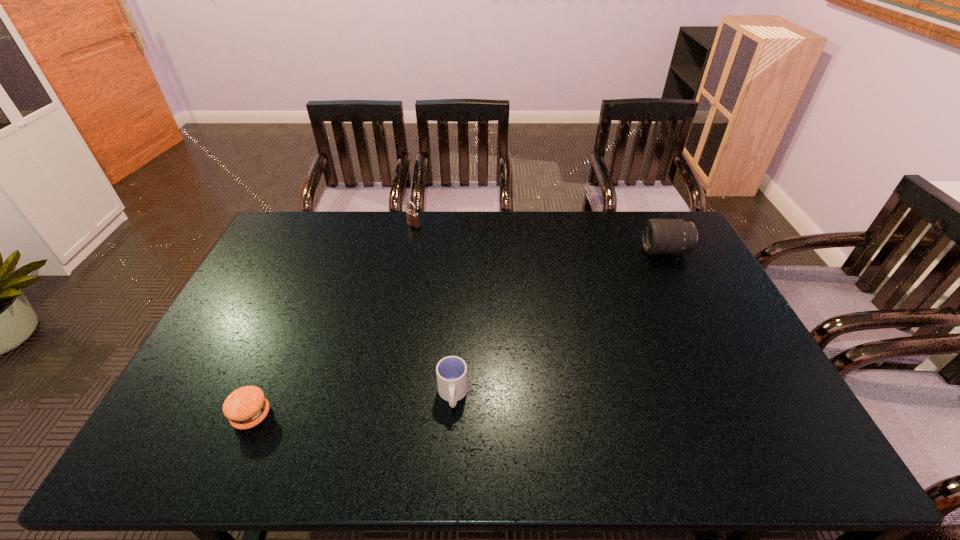
The height and width of the screenshot is (540, 960). I want to click on object positioned at the far right corner, so pos(660,236).

Locate an element on the screen. vacant position at the far edge of the desktop is located at coordinates (601, 220).

In the image, there is a desktop. Identify the location of free region at the near edge. The width and height of the screenshot is (960, 540). (531, 462).

Find the location of a particular element. blank area at the left edge is located at coordinates (221, 424).

Find the location of a particular element. free space at the right edge of the desktop is located at coordinates (705, 294).

This screenshot has width=960, height=540. Identify the location of vacant area at the far left corner. (x=305, y=241).

Find the location of `vacant space at the far right corner of the desktop`. vacant space at the far right corner of the desktop is located at coordinates (645, 217).

The image size is (960, 540). I want to click on free space at the near right corner of the desktop, so click(806, 449).

Where is `free space between the cup and the second farthest object`? Image resolution: width=960 pixels, height=540 pixels. free space between the cup and the second farthest object is located at coordinates (559, 323).

This screenshot has height=540, width=960. I want to click on vacant region between the second object from left to right and the telephoto lens, so click(540, 239).